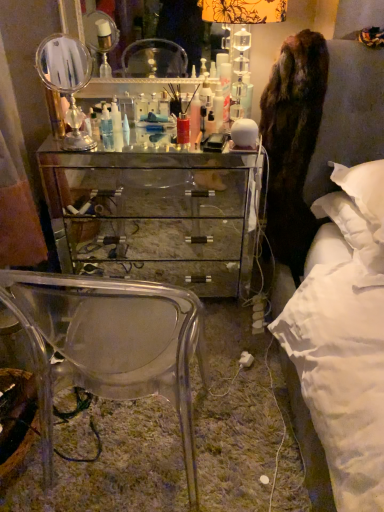
You are a GUI agent. You are given a task and a screenshot of the screen. Output one action in this format:
    pyautogui.click(x=<x>, y=<y>)
    Task: Click on the free spot to the right of white glossy bottle at center, which is the 1th toiletry from right to left
    This screenshot has width=384, height=512.
    Given the screenshot: What is the action you would take?
    pyautogui.click(x=235, y=128)